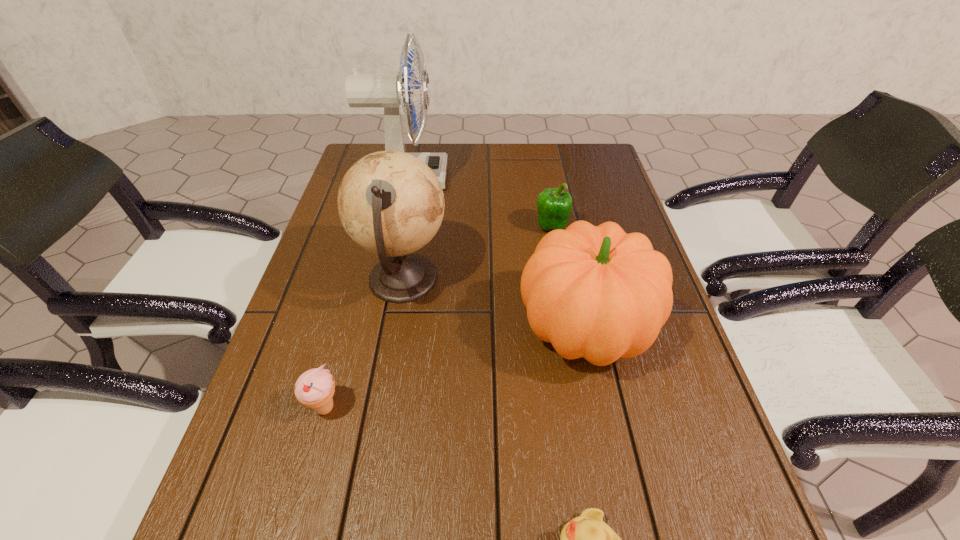
The image size is (960, 540). Find the location of `vacant space situated on the left of the pumpkin`. vacant space situated on the left of the pumpkin is located at coordinates (334, 330).

Identify the location of free point located 0.180m on the right of the third shortest object. Image resolution: width=960 pixels, height=540 pixels. (633, 226).

Identify the location of blank space located on the front of the fifth tallest object. 298,508.

Find the location of `object that is at the far edge`. object that is at the far edge is located at coordinates (390, 91).

Locate an element on the screen. Image resolution: width=960 pixels, height=540 pixels. fan that is at the left edge is located at coordinates (390, 91).

Locate an element on the screen. globe that is positioned at the left edge is located at coordinates pyautogui.click(x=390, y=203).

At what (x,y) coordinates should I click in order to perform the action: click on icecream that is at the left edge. Please return your answer as a coordinate pair (x, y). Looking at the image, I should click on (315, 388).

Where is `object that is at the right edge`? The image size is (960, 540). object that is at the right edge is located at coordinates (595, 292).

In order to click on object located in the far left corner section of the desktop in this screenshot , I will do `click(390, 91)`.

In the image, there is a desktop. Identify the location of vacant space at the far edge. The image size is (960, 540). (488, 156).